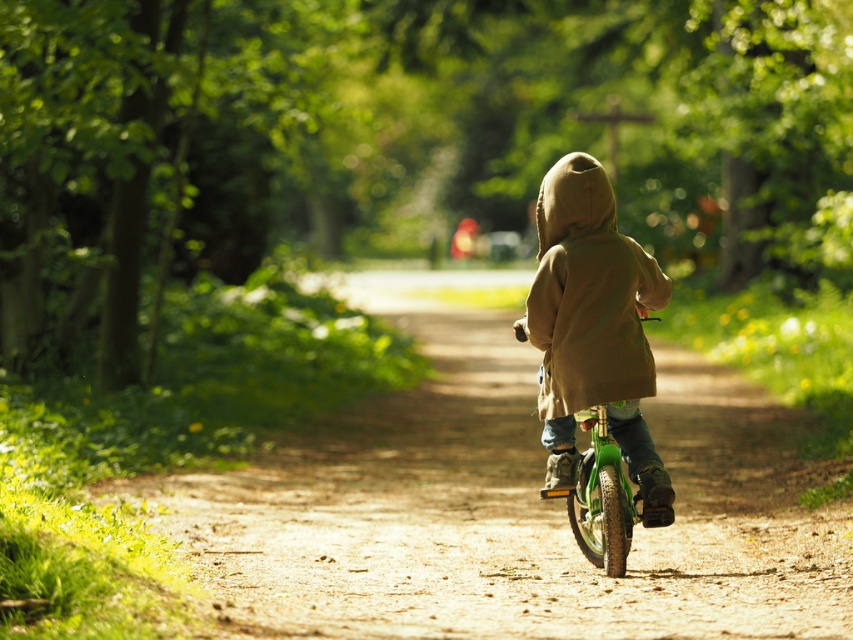
Question: Is camouflage fabric jacket at center to the right of green matte bicycle at center from the viewer's perspective?

Choices:
 (A) yes
 (B) no

Answer: (B)

Question: Which point is farther to the camera?

Choices:
 (A) green matte bicycle at center
 (B) camouflage fabric jacket at center

Answer: (B)

Question: Is camouflage fabric jacket at center behind green matte bicycle at center?

Choices:
 (A) yes
 (B) no

Answer: (A)

Question: Which point is closer to the camera?

Choices:
 (A) camouflage fabric jacket at center
 (B) green matte bicycle at center

Answer: (B)

Question: Which point is closer to the camera?

Choices:
 (A) [x=547, y=355]
 (B) [x=601, y=509]

Answer: (B)

Question: Observing the image, what is the correct spatial positioning of camouflage fabric jacket at center in reference to green matte bicycle at center?

Choices:
 (A) right
 (B) left

Answer: (B)